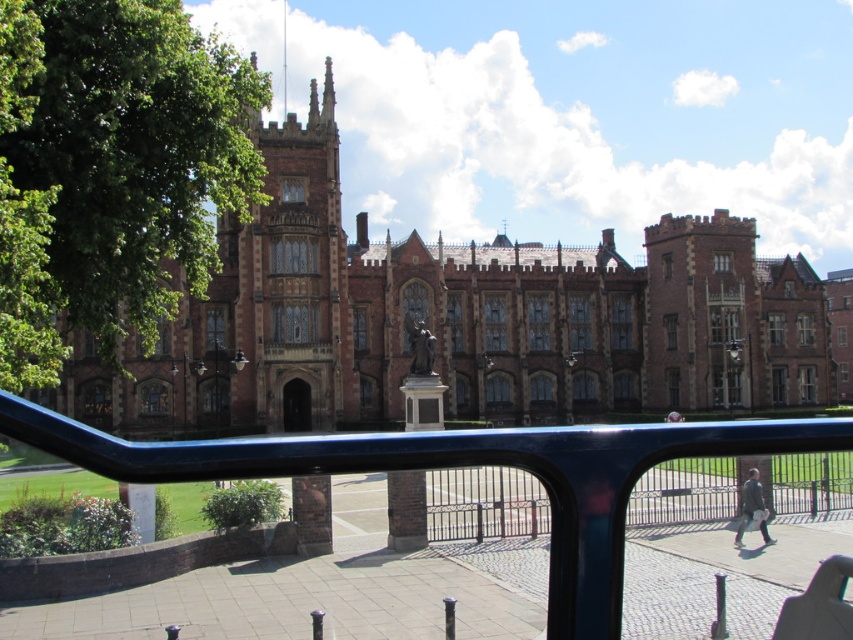
Which is behind, point (268, 205) or point (260, 444)?

Point (268, 205)

Is brown stone palace at center thinner than glossy metal rail at center?

In fact, brown stone palace at center might be wider than glossy metal rail at center.

Is point (810, 365) less distant than point (389, 458)?

That is False.

Image resolution: width=853 pixels, height=640 pixels. What are the coordinates of `brown stone palace at center` in the screenshot? It's located at (457, 321).